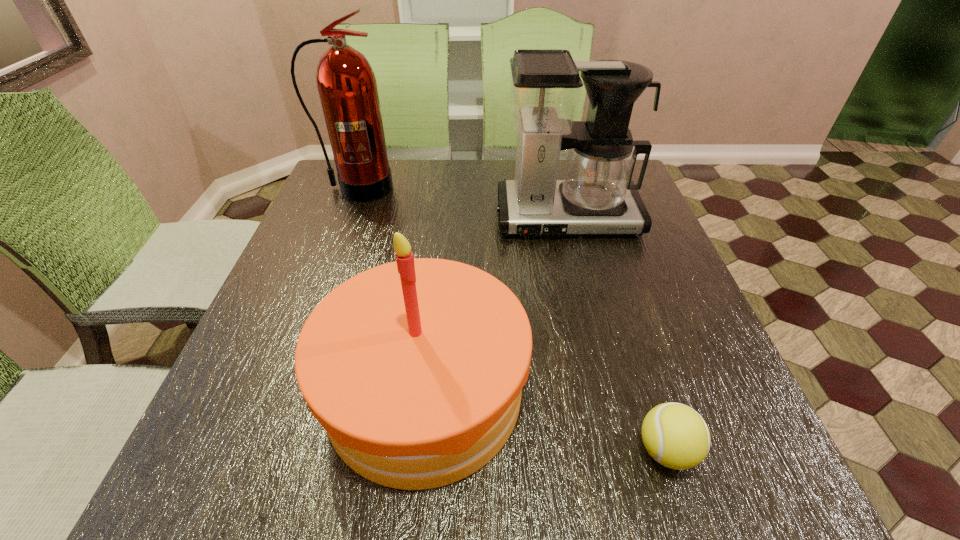
Image resolution: width=960 pixels, height=540 pixels. In order to click on free space at the left edge of the desktop in this screenshot , I will do coord(283,267).

This screenshot has height=540, width=960. Identify the location of free spot at the right edge of the desktop. point(676,304).

Locate an element on the screen. The image size is (960, 540). free region at the far left corner of the desktop is located at coordinates (329, 194).

Where is `vacant space at the near left corner`? The image size is (960, 540). vacant space at the near left corner is located at coordinates (212, 489).

Locate an element on the screen. The height and width of the screenshot is (540, 960). empty location between the coffee maker and the fire extinguisher is located at coordinates (462, 203).

The width and height of the screenshot is (960, 540). I want to click on vacant area between the coffee maker and the fire extinguisher, so click(x=462, y=203).

The height and width of the screenshot is (540, 960). What are the coordinates of `free space between the fire extinguisher and the coffee maker` in the screenshot? It's located at (462, 203).

Identify the location of free area in between the fire extinguisher and the coffee maker. Image resolution: width=960 pixels, height=540 pixels. (462, 203).

At what (x,y) coordinates should I click in order to perform the action: click on empty location between the coffee maker and the shortest object. Please return your answer as a coordinate pair (x, y). Looking at the image, I should click on (616, 334).

This screenshot has width=960, height=540. I want to click on vacant area between the coffee maker and the fire extinguisher, so click(x=462, y=203).